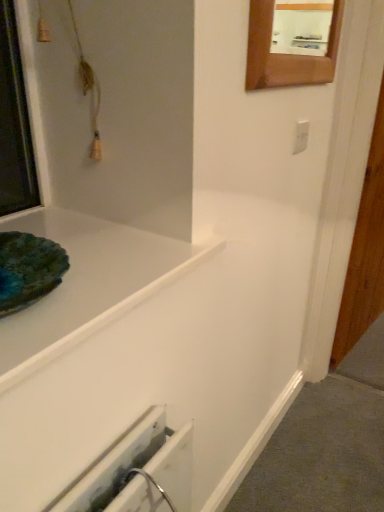
Question: From the image's perspective, does wooden frame mirror at upper right appear higher than white plastic electric outlet at upper right?

Choices:
 (A) yes
 (B) no

Answer: (A)

Question: Is wooden frame mirror at upper right at the left side of white plastic electric outlet at upper right?

Choices:
 (A) yes
 (B) no

Answer: (A)

Question: Could white plastic electric outlet at upper right be considered to be inside wooden frame mirror at upper right?

Choices:
 (A) no
 (B) yes

Answer: (A)

Question: From a real-world perspective, is wooden frame mirror at upper right over white plastic electric outlet at upper right?

Choices:
 (A) yes
 (B) no

Answer: (A)

Question: From a real-world perspective, is wooden frame mirror at upper right positioned under white plastic electric outlet at upper right based on gravity?

Choices:
 (A) yes
 (B) no

Answer: (B)

Question: Does point (301, 140) appear closer or farther from the camera than point (112, 372)?

Choices:
 (A) closer
 (B) farther

Answer: (B)

Question: Is white plastic electric outlet at upper right to the left or to the right of white glossy bathtub at upper left in the image?

Choices:
 (A) left
 (B) right

Answer: (B)

Question: Is white plastic electric outlet at upper right spatially inside white glossy bathtub at upper left, or outside of it?

Choices:
 (A) outside
 (B) inside

Answer: (A)

Question: From a real-world perspective, relative to white glossy bathtub at upper left, is white plastic electric outlet at upper right vertically above or below?

Choices:
 (A) above
 (B) below

Answer: (A)

Question: From the image's perspective, is wooden frame mirror at upper right above or below white plastic electric outlet at upper right?

Choices:
 (A) above
 (B) below

Answer: (A)

Question: Based on their positions, is wooden frame mirror at upper right located to the left or right of white plastic electric outlet at upper right?

Choices:
 (A) right
 (B) left

Answer: (B)

Question: Considering their positions, is wooden frame mirror at upper right located in front of or behind white plastic electric outlet at upper right?

Choices:
 (A) front
 (B) behind

Answer: (A)

Question: Considering the positions of wooden frame mirror at upper right and white plastic electric outlet at upper right in the image, is wooden frame mirror at upper right bigger or smaller than white plastic electric outlet at upper right?

Choices:
 (A) small
 (B) big

Answer: (B)

Question: Considering their positions, is white plastic electric outlet at upper right located in front of or behind wooden frame mirror at upper right?

Choices:
 (A) front
 (B) behind

Answer: (B)

Question: In terms of size, does white plastic electric outlet at upper right appear bigger or smaller than wooden frame mirror at upper right?

Choices:
 (A) big
 (B) small

Answer: (B)